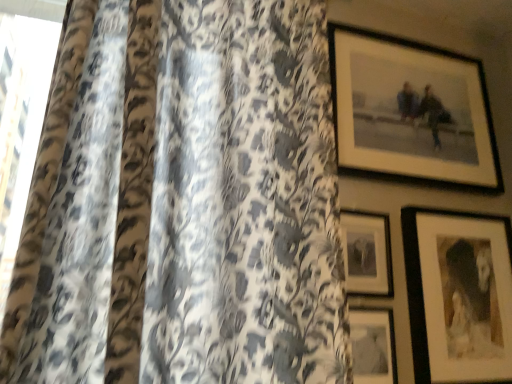
Question: Should I look upward or downward to see matte black picture frame at lower center, positioned as the 4th picture frame in top-to-bottom order?

Choices:
 (A) down
 (B) up

Answer: (A)

Question: Is matte black picture frame at lower right, which is the 2th picture frame from bottom to top, positioned behind matte black picture frame at lower center, the 1th picture frame when ordered from bottom to top?

Choices:
 (A) yes
 (B) no

Answer: (A)

Question: Is matte black picture frame at lower right, which is the 2th picture frame from bottom to top, aimed at matte black picture frame at lower center, positioned as the 4th picture frame in top-to-bottom order?

Choices:
 (A) no
 (B) yes

Answer: (A)

Question: Is matte black picture frame at lower right, which is the 2th picture frame from bottom to top, bigger than matte black picture frame at lower center, positioned as the 4th picture frame in top-to-bottom order?

Choices:
 (A) no
 (B) yes

Answer: (B)

Question: Is matte black picture frame at lower right, which is the 2th picture frame from bottom to top, thinner than matte black picture frame at lower center, positioned as the 4th picture frame in top-to-bottom order?

Choices:
 (A) no
 (B) yes

Answer: (A)

Question: Is matte black picture frame at lower right, which is the 2th picture frame from bottom to top, positioned beyond the bounds of matte black picture frame at lower center, the 1th picture frame when ordered from bottom to top?

Choices:
 (A) no
 (B) yes

Answer: (B)

Question: From the image's perspective, does matte black picture frame at lower right, arranged as the 3th picture frame when viewed from the top, appear higher than matte black picture frame at lower center, the 1th picture frame when ordered from bottom to top?

Choices:
 (A) no
 (B) yes

Answer: (B)

Question: Is matte black picture frame at lower center, positioned as the 4th picture frame in top-to-bottom order, thinner than matte black picture frame at lower right, which is the 2th picture frame from bottom to top?

Choices:
 (A) yes
 (B) no

Answer: (A)

Question: Is matte black picture frame at lower center, positioned as the 4th picture frame in top-to-bottom order, bigger than matte black picture frame at lower right, which is the 2th picture frame from bottom to top?

Choices:
 (A) no
 (B) yes

Answer: (A)

Question: Can you confirm if matte black picture frame at lower center, positioned as the 4th picture frame in top-to-bottom order, is wider than matte black picture frame at lower right, arranged as the 3th picture frame when viewed from the top?

Choices:
 (A) yes
 (B) no

Answer: (B)

Question: Does matte black picture frame at lower center, the 1th picture frame when ordered from bottom to top, appear on the left side of matte black picture frame at lower right, which is the 2th picture frame from bottom to top?

Choices:
 (A) no
 (B) yes

Answer: (B)

Question: From the image's perspective, would you say matte black picture frame at lower center, positioned as the 4th picture frame in top-to-bottom order, is shown under matte black picture frame at lower right, arranged as the 3th picture frame when viewed from the top?

Choices:
 (A) no
 (B) yes

Answer: (B)

Question: Are matte black picture frame at lower center, the 1th picture frame when ordered from bottom to top, and matte black picture frame at lower right, which is the 2th picture frame from bottom to top, far apart?

Choices:
 (A) no
 (B) yes

Answer: (A)

Question: Considering the relative sizes of matte black picture frame at center, placed as the 2th picture frame when sorted from top to bottom, and matte black picture frame at upper right, marked as the 4th picture frame in a bottom-to-top arrangement, in the image provided, is matte black picture frame at center, placed as the 2th picture frame when sorted from top to bottom, shorter than matte black picture frame at upper right, marked as the 4th picture frame in a bottom-to-top arrangement,?

Choices:
 (A) yes
 (B) no

Answer: (A)